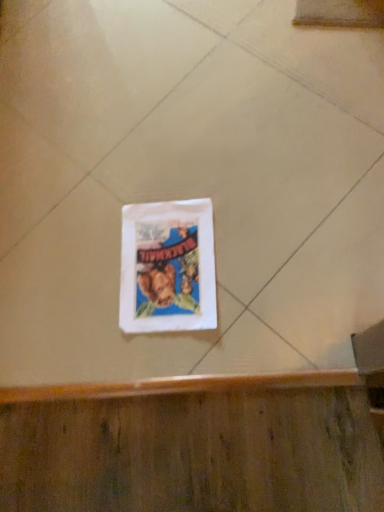
Where is `free space to the back side of white paper bag at center`? The image size is (384, 512). free space to the back side of white paper bag at center is located at coordinates (132, 180).